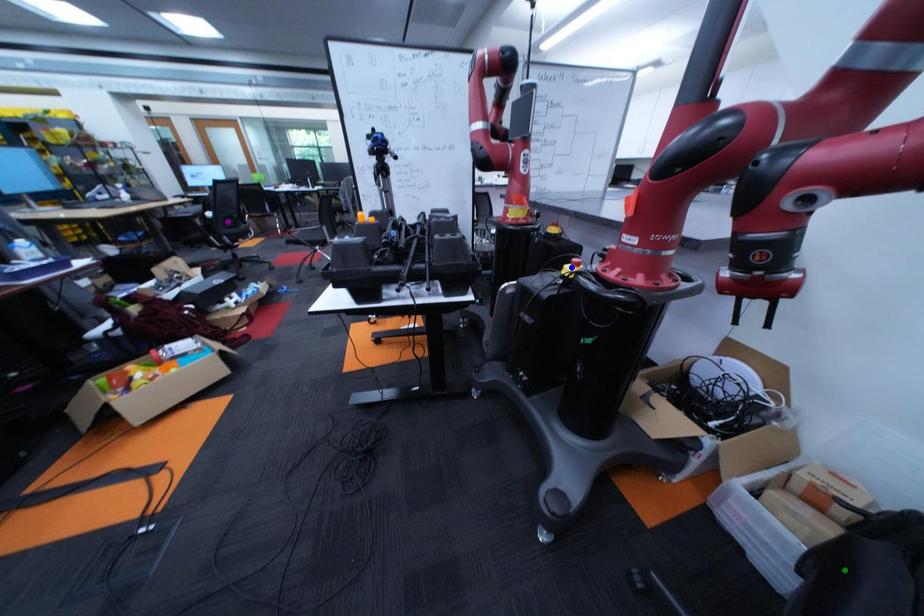
Order these from nearest to farthest:
- purple point
- green point
- blue point

green point → blue point → purple point